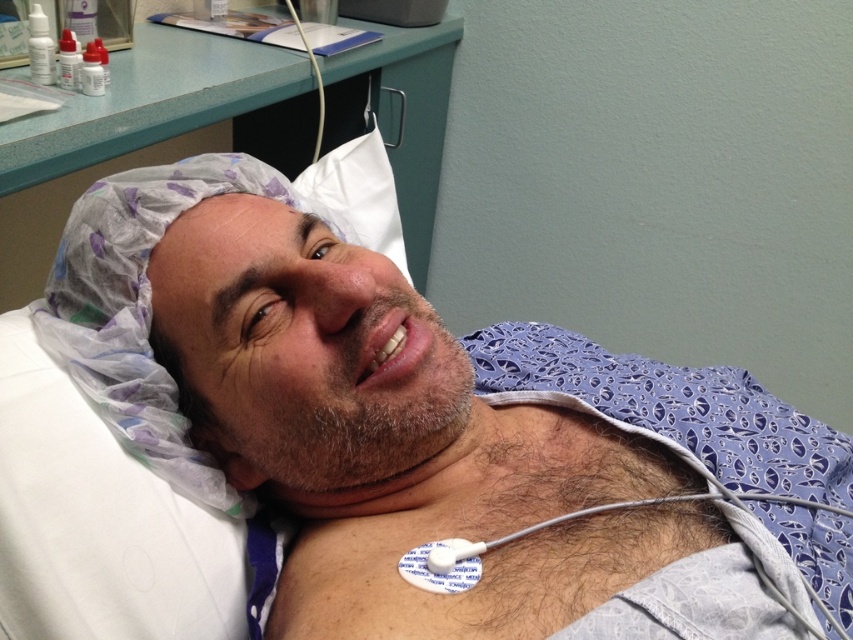
Is white fabric at center further to camera compared to white plastic hair cover at upper left?

No, it is in front of white plastic hair cover at upper left.

Is white fabric at center to the right of white plastic hair cover at upper left from the viewer's perspective?

Indeed, white fabric at center is positioned on the right side of white plastic hair cover at upper left.

Identify the location of white fabric at center. Image resolution: width=853 pixels, height=640 pixels. (428, 433).

I want to click on white fabric at center, so click(428, 433).